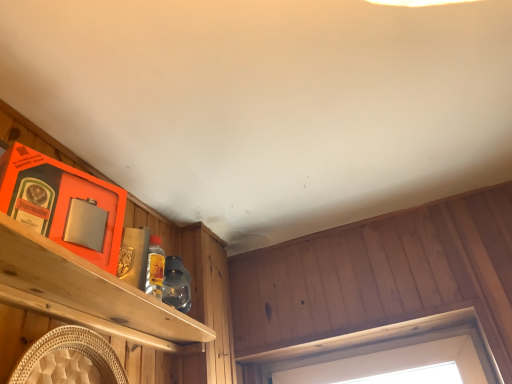
Question: Should I look upward or downward to see wooden frame at upper center?

Choices:
 (A) down
 (B) up

Answer: (A)

Question: Could wooden frame at upper center be considered to be inside brushed metal shelf at left?

Choices:
 (A) yes
 (B) no

Answer: (B)

Question: Is brushed metal shelf at left to the right of wooden frame at upper center from the viewer's perspective?

Choices:
 (A) yes
 (B) no

Answer: (B)

Question: Is brushed metal shelf at left shorter than wooden frame at upper center?

Choices:
 (A) no
 (B) yes

Answer: (A)

Question: Could you tell me if brushed metal shelf at left is facing wooden frame at upper center?

Choices:
 (A) no
 (B) yes

Answer: (A)

Question: Is brushed metal shelf at left closer to the viewer compared to wooden frame at upper center?

Choices:
 (A) yes
 (B) no

Answer: (A)

Question: From a real-world perspective, is brushed metal shelf at left on wooden frame at upper center?

Choices:
 (A) yes
 (B) no

Answer: (B)

Question: Can you confirm if wooden frame at upper center is bigger than brushed metal shelf at left?

Choices:
 (A) yes
 (B) no

Answer: (B)

Question: Is wooden frame at upper center smaller than brushed metal shelf at left?

Choices:
 (A) yes
 (B) no

Answer: (A)

Question: Is wooden frame at upper center positioned far away from brushed metal shelf at left?

Choices:
 (A) yes
 (B) no

Answer: (B)

Question: Can brushed metal shelf at left be found inside wooden frame at upper center?

Choices:
 (A) yes
 (B) no

Answer: (B)

Question: Is wooden frame at upper center positioned beyond the bounds of brushed metal shelf at left?

Choices:
 (A) no
 (B) yes

Answer: (B)

Question: From a real-world perspective, is wooden frame at upper center beneath brushed metal shelf at left?

Choices:
 (A) no
 (B) yes

Answer: (A)

Question: From the image's perspective, is brushed metal shelf at left above or below wooden frame at upper center?

Choices:
 (A) below
 (B) above

Answer: (B)